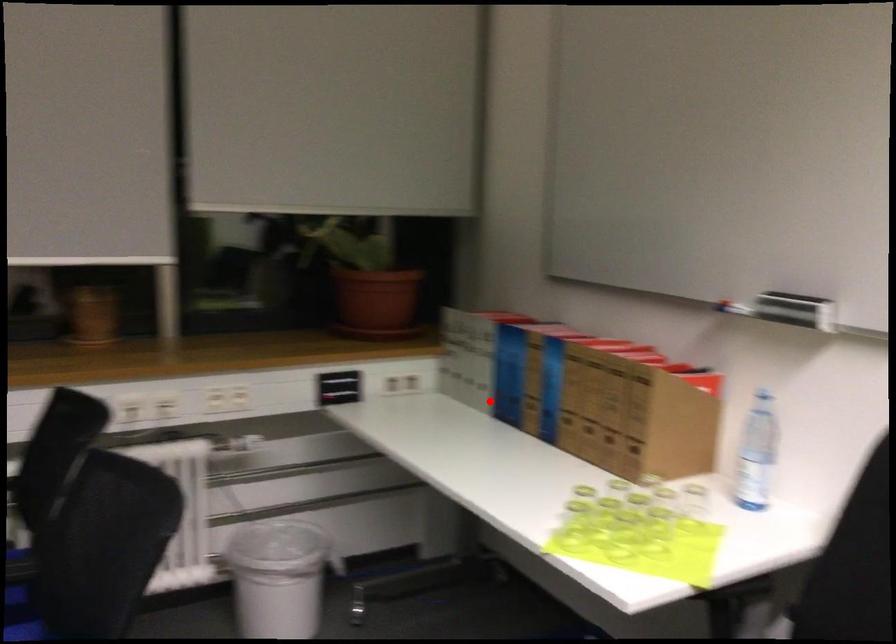
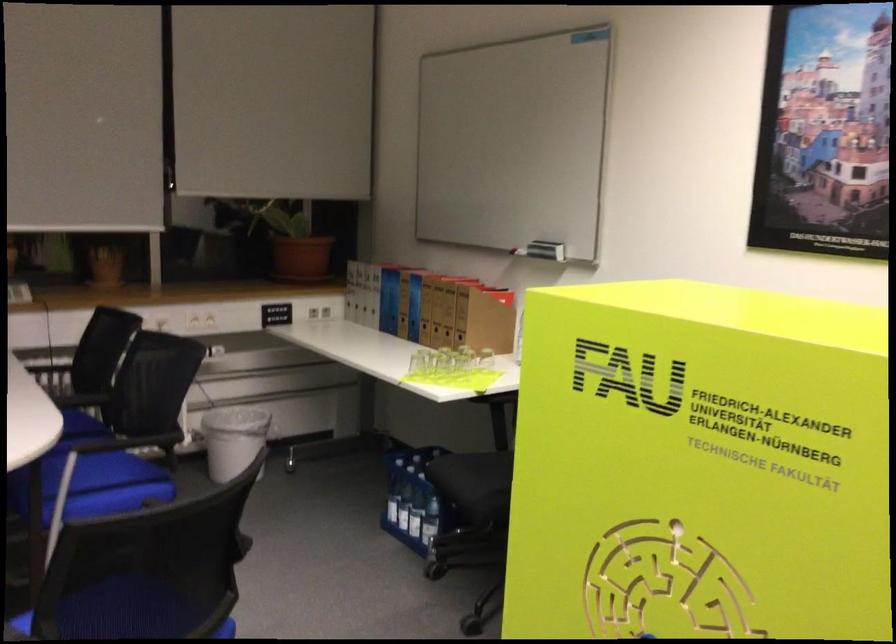
Question: I am providing you with two images of the same scene from different viewpoints. A red point is marked on the first image. Is the red point's position out of view in image 2?

Choices:
 (A) Yes
 (B) No

Answer: (B)